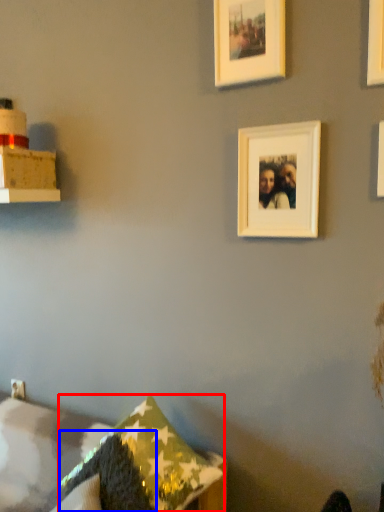
Question: Which point is further to the camera, pillow (highlighted by a red box) or pillow (highlighted by a blue box)?

Choices:
 (A) pillow
 (B) pillow

Answer: (A)